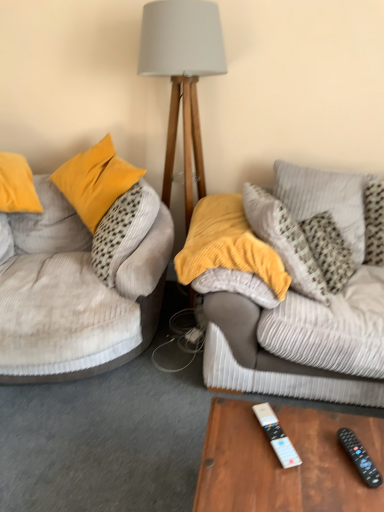
Image resolution: width=384 pixels, height=512 pixels. What are the coordinates of `vacant area in front of white plastic remote control at lower center, which is counted as the first remote control, starting from the left` in the screenshot? It's located at (280, 482).